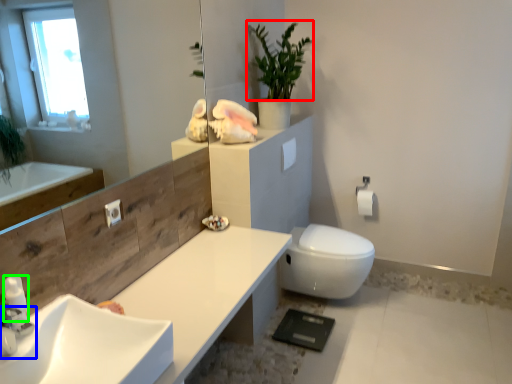
Question: Which object is the closest to the plant (highlighted by a red box)? Choose among these: tap (highlighted by a blue box) or soap dispenser (highlighted by a green box).

Choices:
 (A) tap
 (B) soap dispenser

Answer: (B)